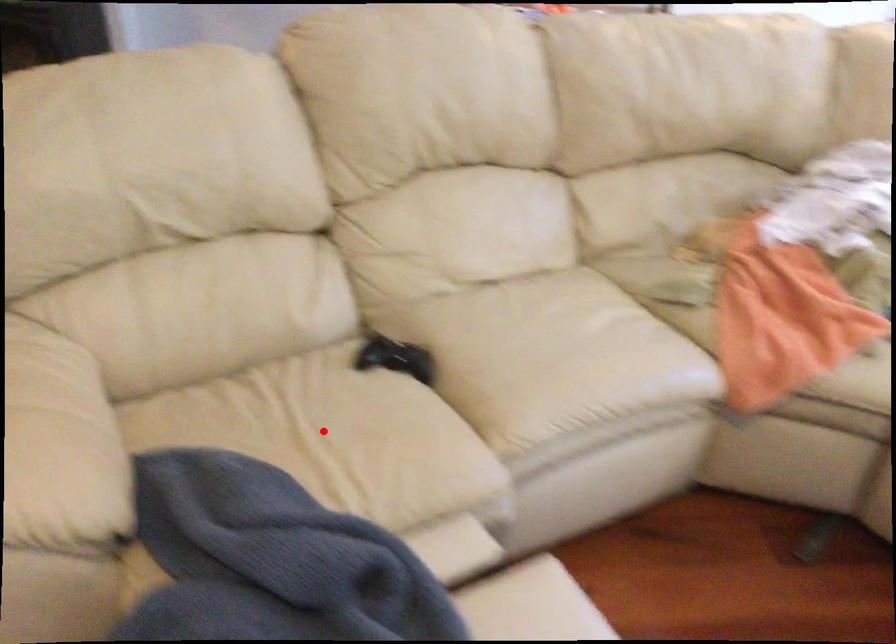
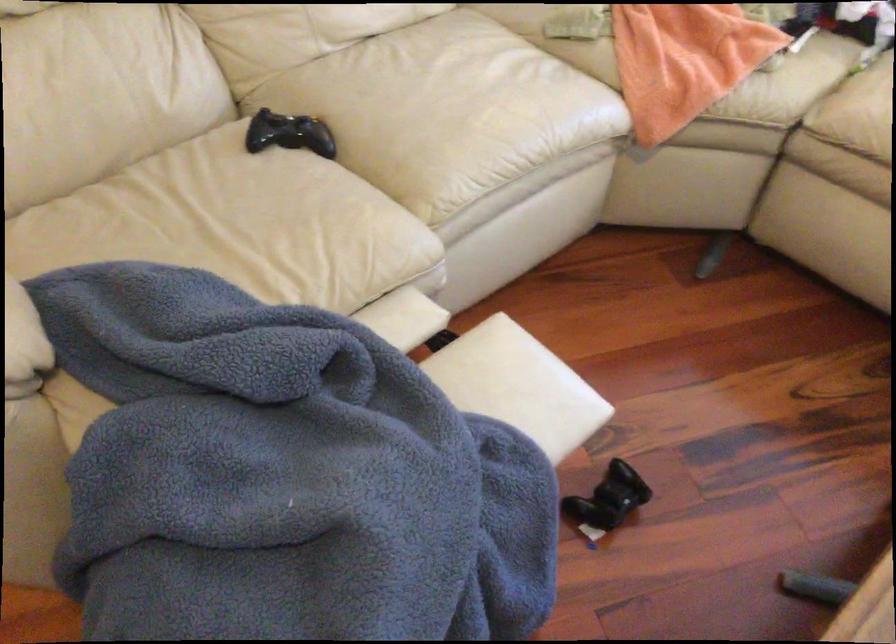
Locate, in the second image, the point that corresponds to the highlighted location in the first image.

(237, 225)